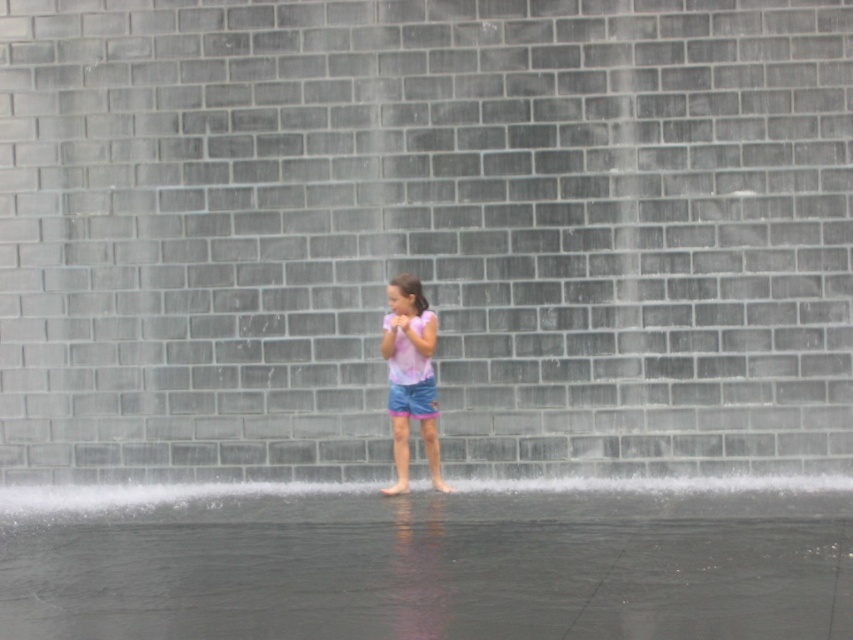
You are a photographer trying to capture the girl in the image. You want to ensure that both the pink cotton shirt at center and the blue denim shorts at center are visible in your shot. Based on their positions, which side of the girl should you focus on to include both items?

The pink cotton shirt at center is to the left of the blue denim shorts at center, so focusing on the left side of the girl will ensure both the pink cotton shirt at center and the blue denim shorts at center are visible.

The girl is standing in the scene with clear water at lower center and blue denim shorts at center. Which object is positioned lower in the image?

The clear water at lower center is positioned below the blue denim shorts at center, so the clear water at lower center is lower in the image.

You are a drone operator trying to capture a photo of the girl in the scene. The drone is currently at point A, which is directly above the clear water at lower center. To get the best shot, you need to move the drone 0.3 units to the right along the x axis. What are the new coordinates of the drone after moving?

The clear water at lower center is at point (430, 560). Moving 0.3 units to the right along the x axis would add 0.3 to the x coordinate. The new coordinates are (430, 639).